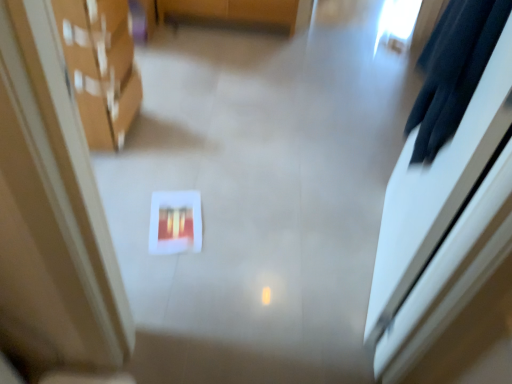
Question: Does matte cardboard boxes at left have a smaller size compared to matte red book at center?

Choices:
 (A) yes
 (B) no

Answer: (B)

Question: Is matte cardboard boxes at left turned away from matte red book at center?

Choices:
 (A) no
 (B) yes

Answer: (A)

Question: From a real-world perspective, is matte cardboard boxes at left below matte red book at center?

Choices:
 (A) yes
 (B) no

Answer: (B)

Question: Considering the relative sizes of matte cardboard boxes at left and matte red book at center in the image provided, is matte cardboard boxes at left thinner than matte red book at center?

Choices:
 (A) no
 (B) yes

Answer: (A)

Question: Is matte cardboard boxes at left positioned beyond the bounds of matte red book at center?

Choices:
 (A) no
 (B) yes

Answer: (B)

Question: Relative to matte red book at center, is black fabric robe at upper right in front or behind?

Choices:
 (A) front
 (B) behind

Answer: (A)

Question: Is black fabric robe at upper right inside the boundaries of matte red book at center, or outside?

Choices:
 (A) inside
 (B) outside

Answer: (B)

Question: Would you say black fabric robe at upper right is to the left or to the right of matte red book at center in the picture?

Choices:
 (A) right
 (B) left

Answer: (A)

Question: From the image's perspective, is black fabric robe at upper right positioned above or below matte red book at center?

Choices:
 (A) above
 (B) below

Answer: (A)

Question: From the image's perspective, is black fabric robe at upper right above or below matte cardboard boxes at left?

Choices:
 (A) above
 (B) below

Answer: (B)

Question: From a real-world perspective, relative to matte cardboard boxes at left, is black fabric robe at upper right vertically above or below?

Choices:
 (A) below
 (B) above

Answer: (B)

Question: In the image, is black fabric robe at upper right positioned in front of or behind matte cardboard boxes at left?

Choices:
 (A) behind
 (B) front

Answer: (B)

Question: Choose the correct answer: Is black fabric robe at upper right inside matte cardboard boxes at left or outside it?

Choices:
 (A) inside
 (B) outside

Answer: (B)

Question: From the image's perspective, relative to matte cardboard boxes at left, is matte red book at center above or below?

Choices:
 (A) below
 (B) above

Answer: (A)

Question: Is matte red book at center to the left or to the right of matte cardboard boxes at left in the image?

Choices:
 (A) right
 (B) left

Answer: (A)